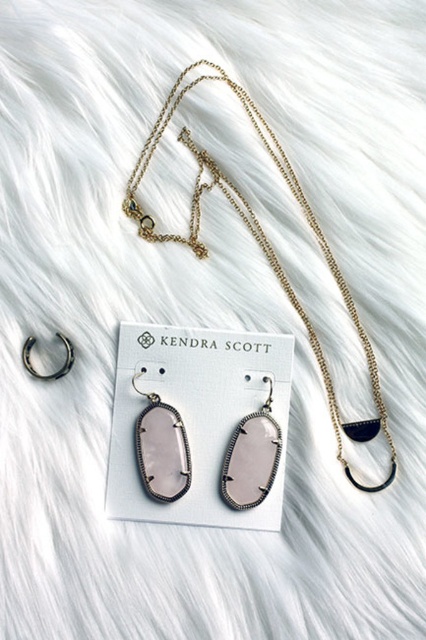
You are a customer looking to purchase a necklace from the Kendra Scott jewelry display. The display has a white fluffy background. There is a point marked at coordinates (259,244). Which jewelry item is located at that point?

The point at coordinates (259,244) indicates the gold chain necklace at upper center.

You are a photographer setting up a shot for a jewelry catalog. You need to ensure that the gold chain necklace at upper center is in focus while the background remains slightly blurred. Given that the necklace is 3.64 feet from the camera, what should you adjust on your camera to achieve this effect?

To ensure the gold chain necklace at upper center is in focus while keeping the background blurred, set the camera focus distance to 3.64 feet. This will keep the necklace sharp and create a shallow depth of field, blurring the background.

Based on the photo, you are a customer looking at the jewelry display. There are two points marked on the image, one at coordinates point (365, 346) and the other at point (262, 465). Which point is closer to you?

Point (262, 465) is closer to you because it is in front of point (365, 346).